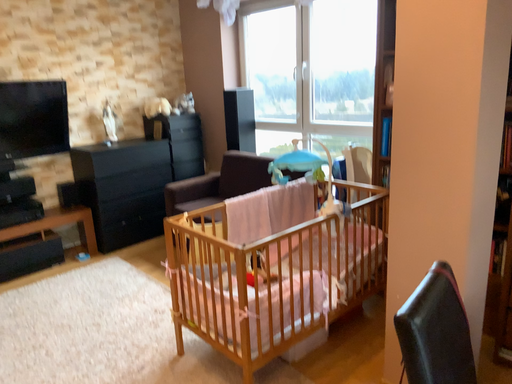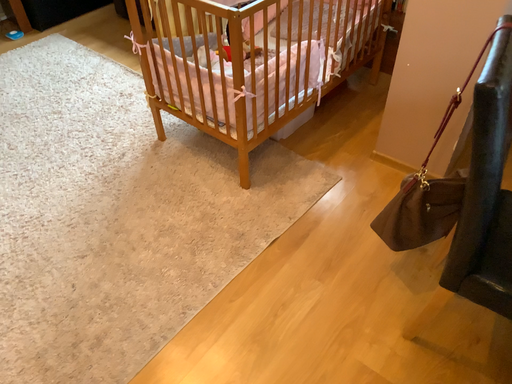
Question: Which way did the camera rotate in the video?

Choices:
 (A) rotated right
 (B) rotated left

Answer: (A)